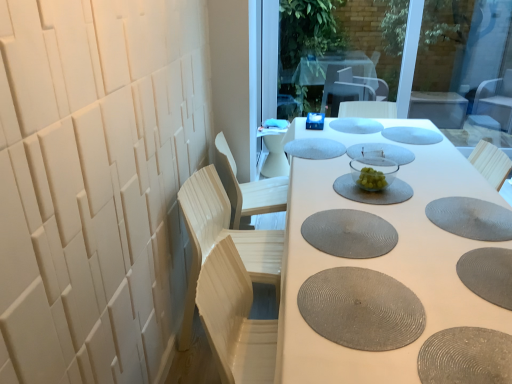
Find the location of a particular element. The width and height of the screenshot is (512, 384). free space between gray textured placemat at lower right, which is the fifth manhole cover from front to back, and light blue fabric cushion at center, the third manhole cover when ordered from back to front is located at coordinates (388, 178).